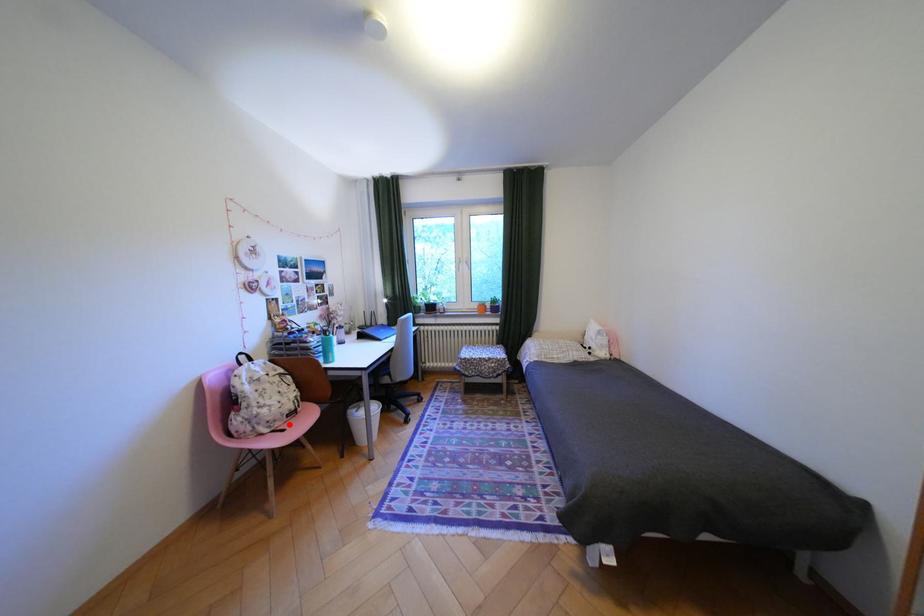
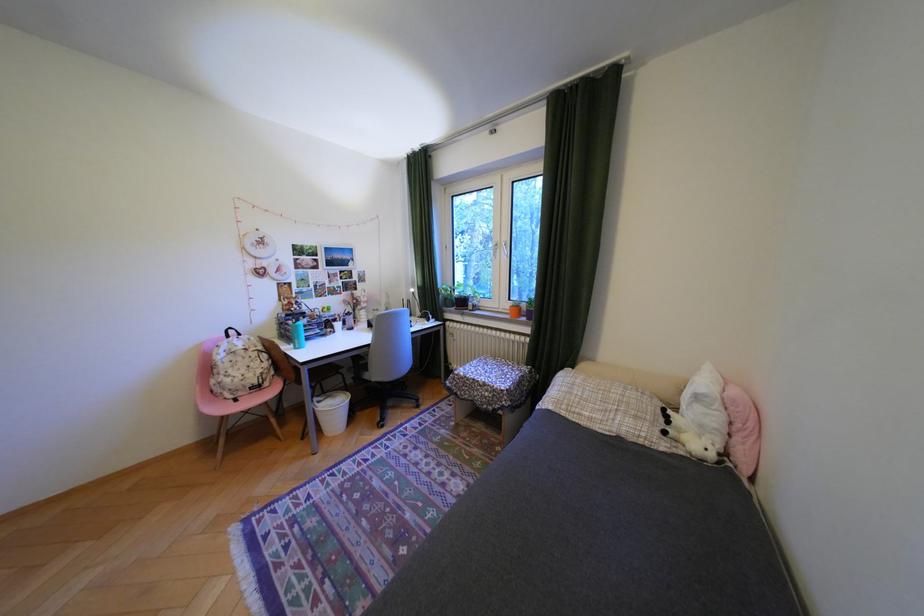
In the second image, find the point that corresponds to the highlighted location in the first image.

(251, 394)